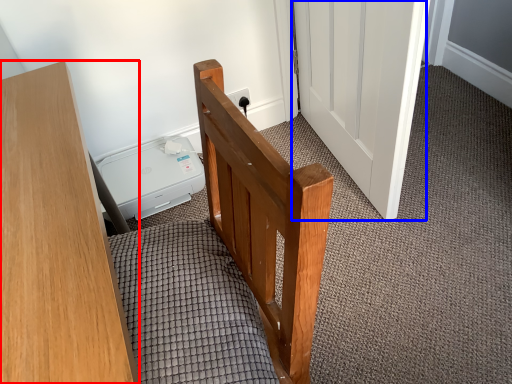
Question: Which object is further to the camera taking this photo, furniture (highlighted by a red box) or door (highlighted by a blue box)?

Choices:
 (A) furniture
 (B) door

Answer: (B)